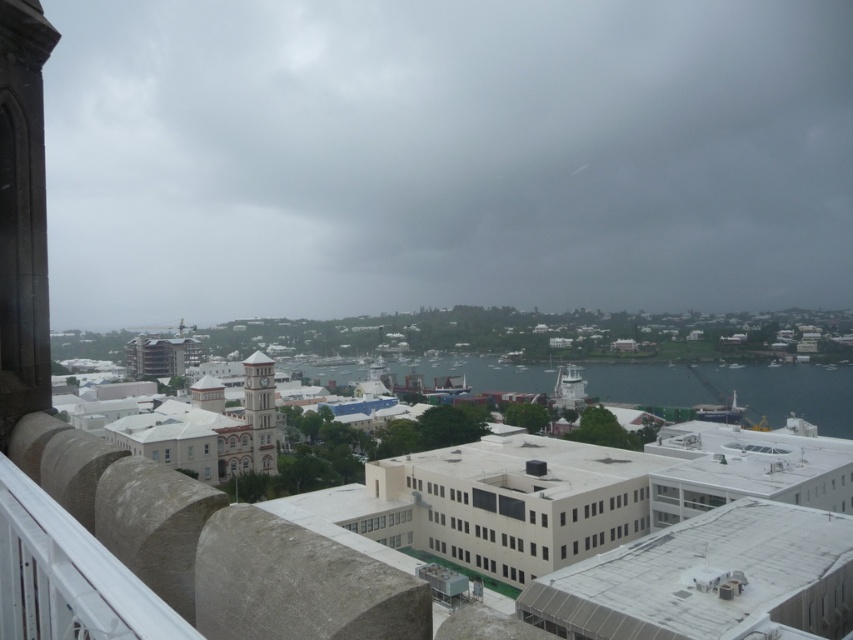
Question: Does clear water at center come behind white stone clock tower at center?

Choices:
 (A) no
 (B) yes

Answer: (B)

Question: Is clear water at center above white stone clock tower at center?

Choices:
 (A) yes
 (B) no

Answer: (B)

Question: Considering the relative positions of clear water at center and white stone clock tower at center in the image provided, where is clear water at center located with respect to white stone clock tower at center?

Choices:
 (A) right
 (B) left

Answer: (A)

Question: Which of the following is the closest to the observer?

Choices:
 (A) white stone clock tower at center
 (B) clear water at center

Answer: (A)

Question: Which point appears closest to the camera in this image?

Choices:
 (A) (519, 387)
 (B) (262, 472)

Answer: (B)